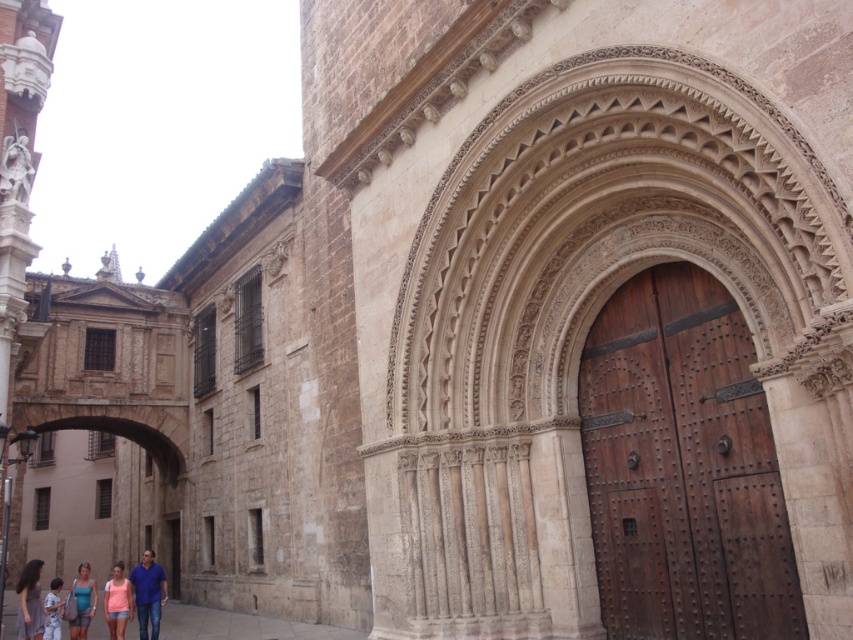
Question: Does matte blue tank top at lower left have a greater width compared to light blue fabric shirt at lower left?

Choices:
 (A) yes
 (B) no

Answer: (B)

Question: Which point appears farthest from the camera in this image?

Choices:
 (A) (51, 580)
 (B) (73, 588)

Answer: (A)

Question: Which point appears closest to the camera in this image?

Choices:
 (A) (141, 620)
 (B) (51, 579)
 (C) (634, 378)
 (D) (26, 602)

Answer: (C)

Question: Is the position of pink fabric shorts at lower left more distant than that of matte blue tank top at lower left?

Choices:
 (A) no
 (B) yes

Answer: (A)

Question: Is brown wooden door at center closer to the viewer compared to matte blue tank top at lower left?

Choices:
 (A) yes
 (B) no

Answer: (A)

Question: Which point is farther to the camera?

Choices:
 (A) (27, 563)
 (B) (59, 621)
 (C) (111, 596)
 (D) (82, 602)

Answer: (A)